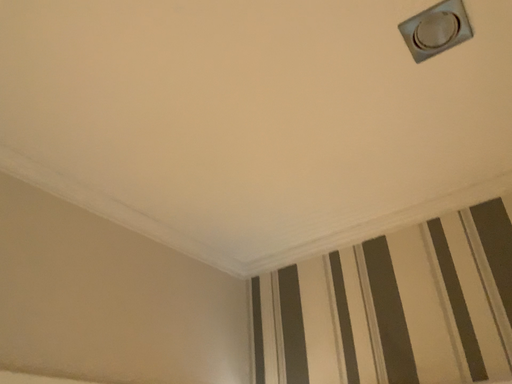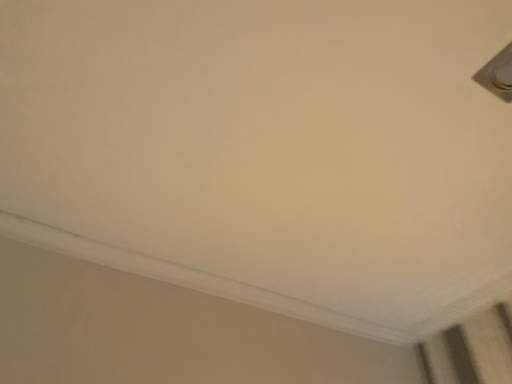
Question: How did the camera likely rotate when shooting the video?

Choices:
 (A) rotated downward
 (B) rotated upward

Answer: (B)